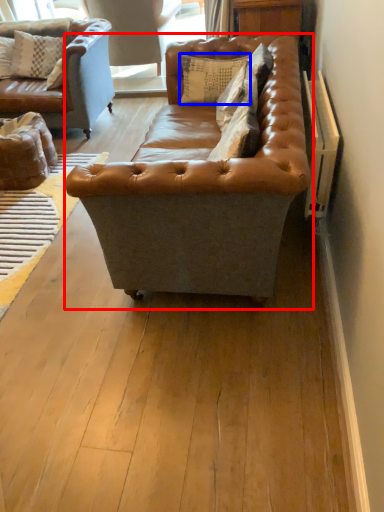
Question: Which of the following is the closest to the observer, studio couch (highlighted by a red box) or pillow (highlighted by a blue box)?

Choices:
 (A) studio couch
 (B) pillow

Answer: (A)